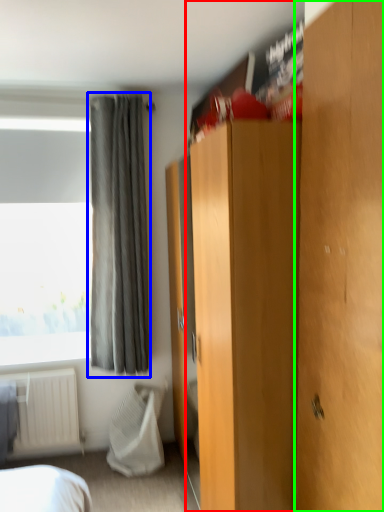
Question: Estimate the real-world distances between objects in this image. Which object is farther from dresser (highlighted by a red box), curtain (highlighted by a blue box) or door (highlighted by a green box)?

Choices:
 (A) curtain
 (B) door

Answer: (A)